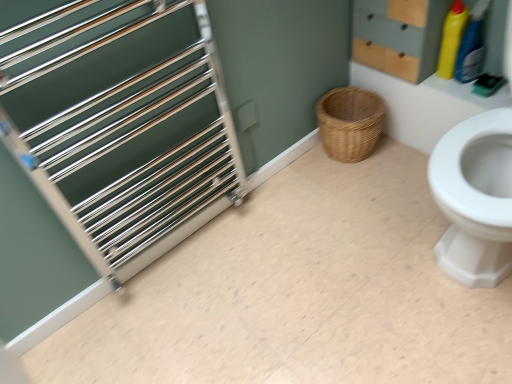
Locate an element on the screen. The image size is (512, 384). blank space above brushed metal towel rack at left (from a real-world perspective) is located at coordinates (313, 276).